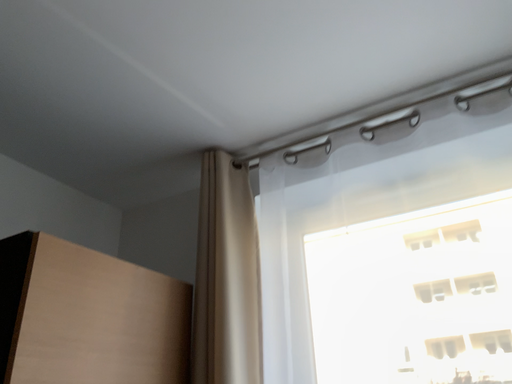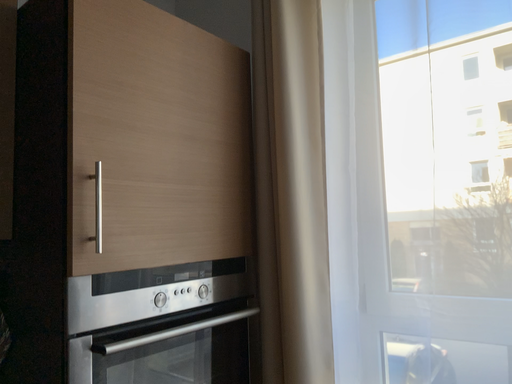
Question: Which way did the camera rotate in the video?

Choices:
 (A) rotated downward
 (B) rotated upward

Answer: (A)